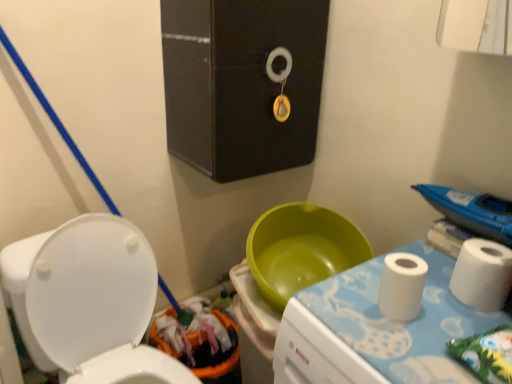
This screenshot has height=384, width=512. Find the location of `vacant space that is to the left of white matte toilet paper at right`. vacant space that is to the left of white matte toilet paper at right is located at coordinates (339, 310).